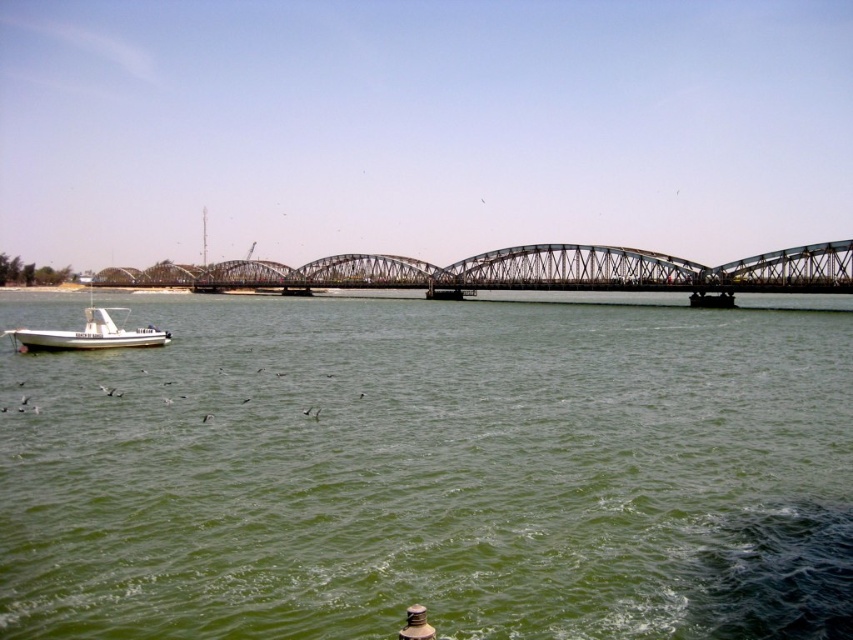
Can you confirm if green water at lower center is shorter than metallic bridge at center?

No.

At what (x,y) coordinates should I click in order to perform the action: click on green water at lower center. Please return your answer as a coordinate pair (x, y). Looking at the image, I should click on (432, 474).

Is point (47, 440) more distant than point (154, 275)?

That is False.

This screenshot has height=640, width=853. Identify the location of green water at lower center. (432, 474).

Is point (315, 380) positioned in front of point (120, 333)?

Yes, point (315, 380) is closer to viewer.

Is green water at lower center shorter than white matte boat at lower left?

No, green water at lower center is not shorter than white matte boat at lower left.

Which is in front, point (619, 582) or point (33, 333)?

Point (619, 582) is in front.

Identify the location of green water at lower center. The image size is (853, 640). (432, 474).

Between metallic bridge at center and white matte boat at lower left, which one has less height?

Standing shorter between the two is metallic bridge at center.

Between metallic bridge at center and white matte boat at lower left, which one is positioned lower?

white matte boat at lower left is lower down.

Is point (556, 266) positioned after point (94, 314)?

Yes.

Identify the location of metallic bridge at center. (518, 272).